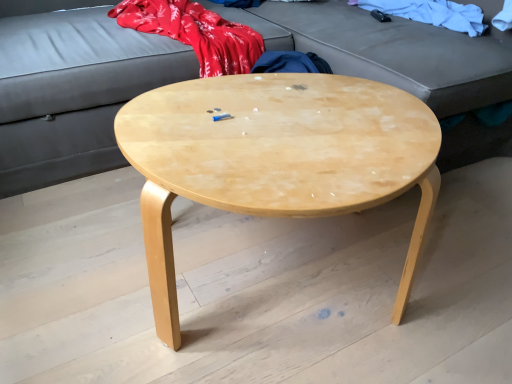
Locate an element on the screen. free point above natural wood coffee table at center (from a real-world perspective) is located at coordinates (289, 124).